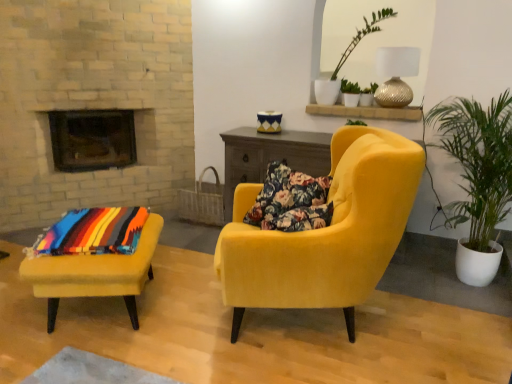
Question: Is green leafy plant in white pot at right at the right side of velvet yellow armchair at center, which ranks as the 2th chair in left-to-right order?

Choices:
 (A) yes
 (B) no

Answer: (A)

Question: Would you say green leafy plant in white pot at right is outside velvet yellow armchair at center, which ranks as the first chair in right-to-left order?

Choices:
 (A) yes
 (B) no

Answer: (A)

Question: Would you say green leafy plant in white pot at right contains velvet yellow armchair at center, which ranks as the 2th chair in left-to-right order?

Choices:
 (A) yes
 (B) no

Answer: (B)

Question: Is green leafy plant in white pot at right positioned before velvet yellow armchair at center, which ranks as the first chair in right-to-left order?

Choices:
 (A) yes
 (B) no

Answer: (B)

Question: Does green leafy plant in white pot at right have a lesser height compared to velvet yellow armchair at center, which ranks as the 2th chair in left-to-right order?

Choices:
 (A) yes
 (B) no

Answer: (B)

Question: From a real-world perspective, is green leafy plant in white pot at right positioned over velvet yellow armchair at center, which ranks as the 2th chair in left-to-right order, based on gravity?

Choices:
 (A) no
 (B) yes

Answer: (B)

Question: From the image's perspective, does green leafy plant in white pot at right appear higher than gold textured lamp at upper right?

Choices:
 (A) no
 (B) yes

Answer: (A)

Question: Is the depth of green leafy plant in white pot at right greater than that of gold textured lamp at upper right?

Choices:
 (A) yes
 (B) no

Answer: (B)

Question: Considering the relative positions of green leafy plant in white pot at right and gold textured lamp at upper right in the image provided, is green leafy plant in white pot at right to the right of gold textured lamp at upper right from the viewer's perspective?

Choices:
 (A) yes
 (B) no

Answer: (A)

Question: Is the depth of green leafy plant in white pot at right less than that of gold textured lamp at upper right?

Choices:
 (A) yes
 (B) no

Answer: (A)

Question: Considering the relative sizes of green leafy plant in white pot at right and gold textured lamp at upper right in the image provided, is green leafy plant in white pot at right thinner than gold textured lamp at upper right?

Choices:
 (A) yes
 (B) no

Answer: (B)

Question: From the image's perspective, is green leafy plant in white pot at right under gold textured lamp at upper right?

Choices:
 (A) no
 (B) yes

Answer: (B)

Question: Considering the relative sizes of green leafy plant at upper center and green leafy plant in white pot at right in the image provided, is green leafy plant at upper center shorter than green leafy plant in white pot at right?

Choices:
 (A) no
 (B) yes

Answer: (B)